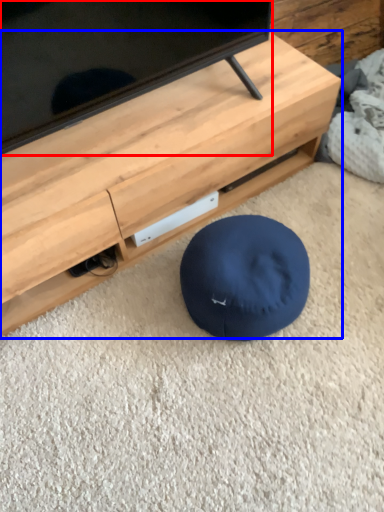
Question: Which point is closer to the camera, television (highlighted by a red box) or furniture (highlighted by a blue box)?

Choices:
 (A) television
 (B) furniture

Answer: (A)